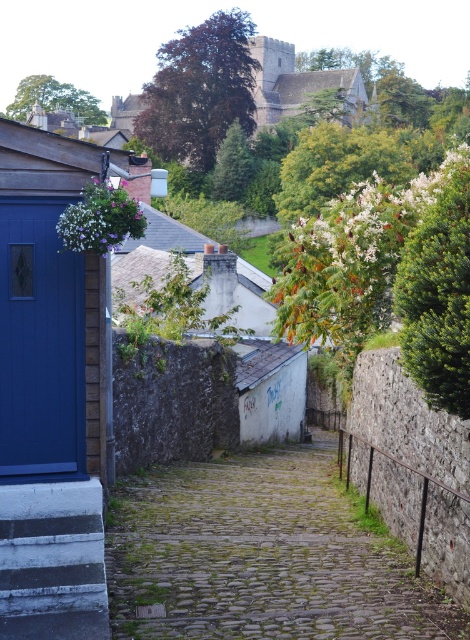
Is cobblestone path at center below white painted wood stairs at lower left?

Indeed, cobblestone path at center is positioned under white painted wood stairs at lower left.

Between cobblestone path at center and white painted wood stairs at lower left, which one is positioned higher?

white painted wood stairs at lower left

What do you see at coordinates (263, 556) in the screenshot? The width and height of the screenshot is (470, 640). I see `cobblestone path at center` at bounding box center [263, 556].

Where is `cobblestone path at center`? The width and height of the screenshot is (470, 640). cobblestone path at center is located at coordinates (263, 556).

Is point (258, 488) positioned before point (62, 211)?

No, (258, 488) is further to viewer.

Between cobblestone path at center and matte blue door at left, which one is positioned higher?

matte blue door at left

Is point (177, 508) positioned before point (75, 410)?

No, it is not.

Locate an element on the screen. Image resolution: width=470 pixels, height=640 pixels. cobblestone path at center is located at coordinates (263, 556).

Does matte blue door at left have a greater height compared to white painted wood stairs at lower left?

Indeed, matte blue door at left has a greater height compared to white painted wood stairs at lower left.

Find the location of a particular element. matte blue door at left is located at coordinates [39, 346].

Image resolution: width=470 pixels, height=640 pixels. What are the coordinates of `matte blue door at left` in the screenshot? It's located at [39, 346].